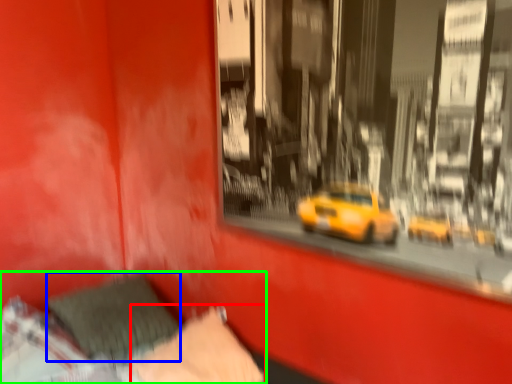
Question: Based on their relative distances, which object is farther from pillow (highlighted by a red box)? Choose from pillow (highlighted by a blue box) and bed (highlighted by a green box).

Choices:
 (A) pillow
 (B) bed

Answer: (A)